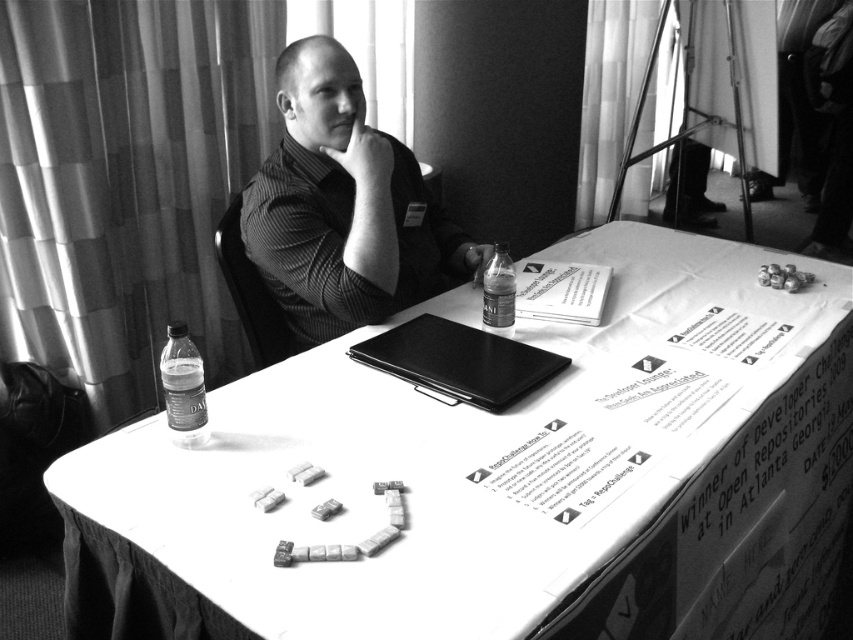
Question: Where is translucent plastic bottle at lower left located in relation to translucent plastic bottle at center in the image?

Choices:
 (A) right
 (B) left

Answer: (B)

Question: Which is nearer to the translucent plastic bottle at center?

Choices:
 (A) black matte laptop at center
 (B) translucent plastic bottle at lower left
 (C) white paper at center

Answer: (A)

Question: Which point appears farthest from the camera in this image?

Choices:
 (A) (350, 173)
 (B) (415, 356)
 (C) (169, 394)
 (D) (708, 461)

Answer: (A)

Question: Based on their relative distances, which object is farther from the matte black shirt at upper center?

Choices:
 (A) translucent plastic bottle at lower left
 (B) white paper at center
 (C) translucent plastic bottle at center
 (D) black matte laptop at center

Answer: (A)

Question: Is black matte laptop at center positioned behind translucent plastic bottle at center?

Choices:
 (A) no
 (B) yes

Answer: (A)

Question: Can you confirm if matte black shirt at upper center is positioned below translucent plastic bottle at center?

Choices:
 (A) no
 (B) yes

Answer: (A)